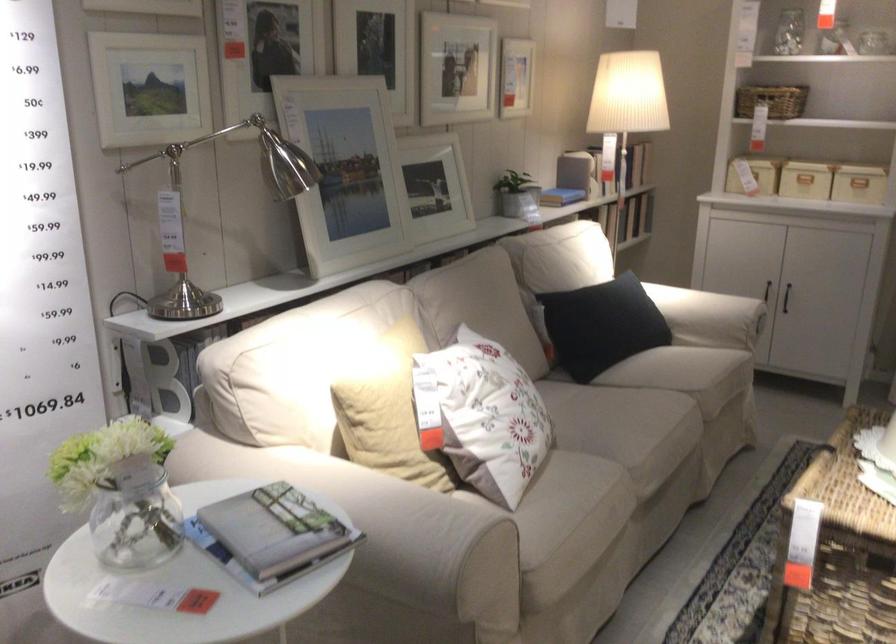
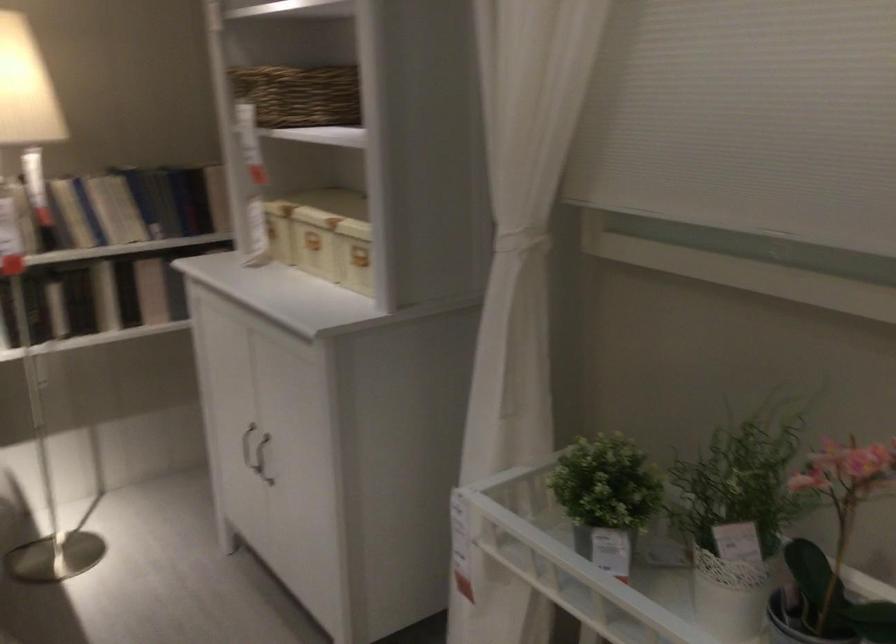
The point at (796, 281) is marked in the first image. Where is the corresponding point in the second image?

(262, 459)